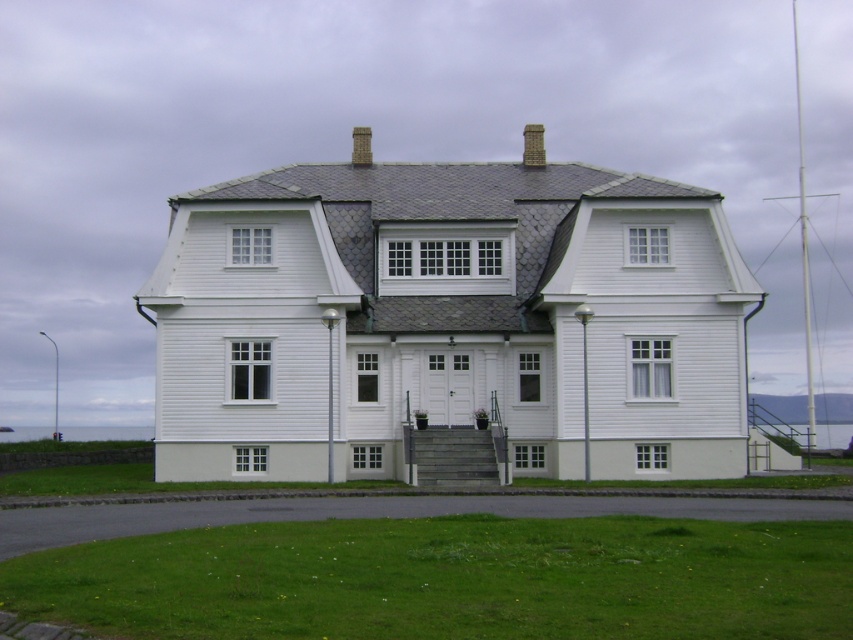
Is gray stone chimney at center closer to the viewer compared to brown brick chimney at upper center?

Yes, it is in front of brown brick chimney at upper center.

Is gray stone chimney at center further to camera compared to brown brick chimney at upper center?

No, gray stone chimney at center is in front of brown brick chimney at upper center.

You are a GUI agent. You are given a task and a screenshot of the screen. Output one action in this format:
    pyautogui.click(x=<x>, y=<y>)
    Task: Click on the gray stone chimney at center
    The image size is (853, 640).
    Given the screenshot: What is the action you would take?
    (448, 320)